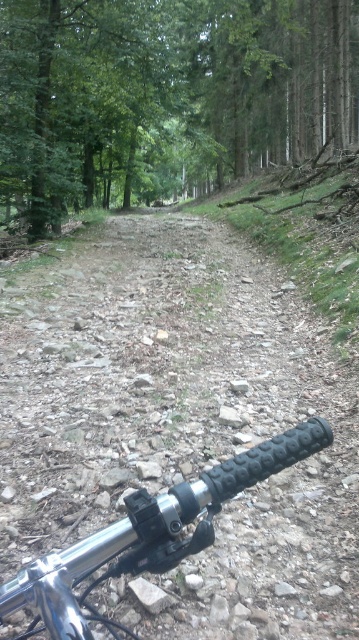
As a cyclist riding along the trail, you notice the green matte tree at center and the black rubber handlebar at lower right. Which object is closer to your current position?

The black rubber handlebar at lower right is behind the green matte tree at center, so the green matte tree at center is closer to your current position.

In the scene shown: You are riding a bike on a forest trail and need to make a quick turn. The dusty gravel path at center and the black rubber handlebar at lower right are in your view. Which object is closer to you?

The black rubber handlebar at lower right is closer to you since it is only 6.05 feet away from the dusty gravel path at center, which is further ahead on the trail.

You are riding a bicycle on a forest trail and need to navigate the path ahead. From your current position, which object is higher in elevation between the dusty gravel path at center and the black rubber handlebar at lower right?

The dusty gravel path at center is taller than the black rubber handlebar at lower right, so the path is higher in elevation.